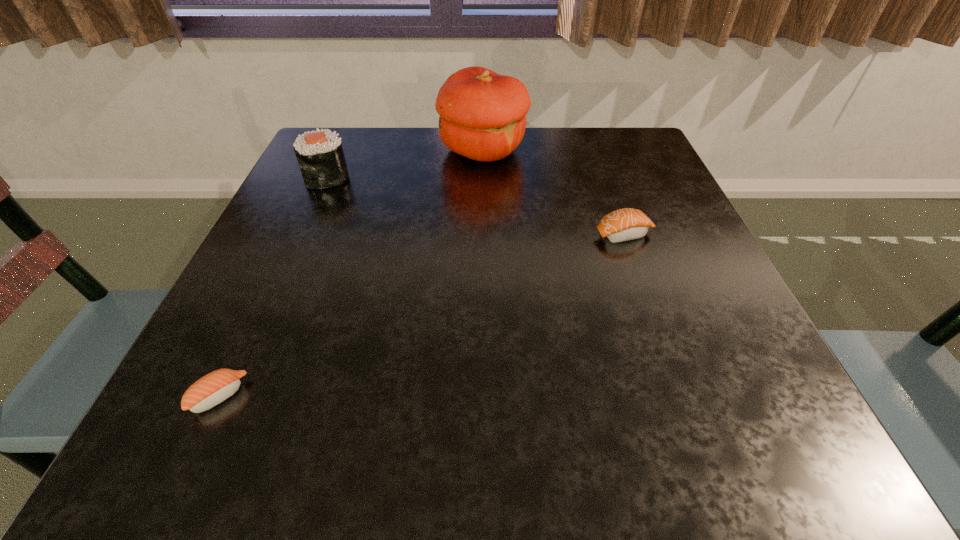
Find the location of a particular element. The height and width of the screenshot is (540, 960). vacant area that lies between the pumpkin and the second tallest object is located at coordinates (405, 164).

Locate an element on the screen. The image size is (960, 540). free area in between the rightmost object and the second tallest object is located at coordinates (475, 206).

You are a GUI agent. You are given a task and a screenshot of the screen. Output one action in this format:
    pyautogui.click(x=<x>, y=<y>)
    Task: Click on the free space between the tallest object and the rightmost object
    The image size is (960, 540).
    Given the screenshot: What is the action you would take?
    pyautogui.click(x=553, y=192)

The image size is (960, 540). In order to click on object that is the closest one to the tallest object in this screenshot , I will do `click(320, 156)`.

Where is `the third closest object to the nearest object`? The image size is (960, 540). the third closest object to the nearest object is located at coordinates (625, 224).

Locate an element on the screen. sushi that is the closest to the nearest object is located at coordinates (320, 156).

Locate an element on the screen. The height and width of the screenshot is (540, 960). sushi that can be found as the third closest to the tallest object is located at coordinates (212, 389).

Locate an element on the screen. This screenshot has width=960, height=540. free space that satisfies the following two spatial constraints: 1. on the front side of the tallest object; 2. on the right side of the rightmost object is located at coordinates (483, 234).

The image size is (960, 540). In order to click on vacant space that satisfies the following two spatial constraints: 1. on the front side of the third shortest object; 2. on the right side of the rightmost object in this screenshot , I will do `click(301, 234)`.

Find the location of a particular element. The width and height of the screenshot is (960, 540). vacant space that satisfies the following two spatial constraints: 1. on the back side of the farthest sushi; 2. on the right side of the pumpkin is located at coordinates (339, 150).